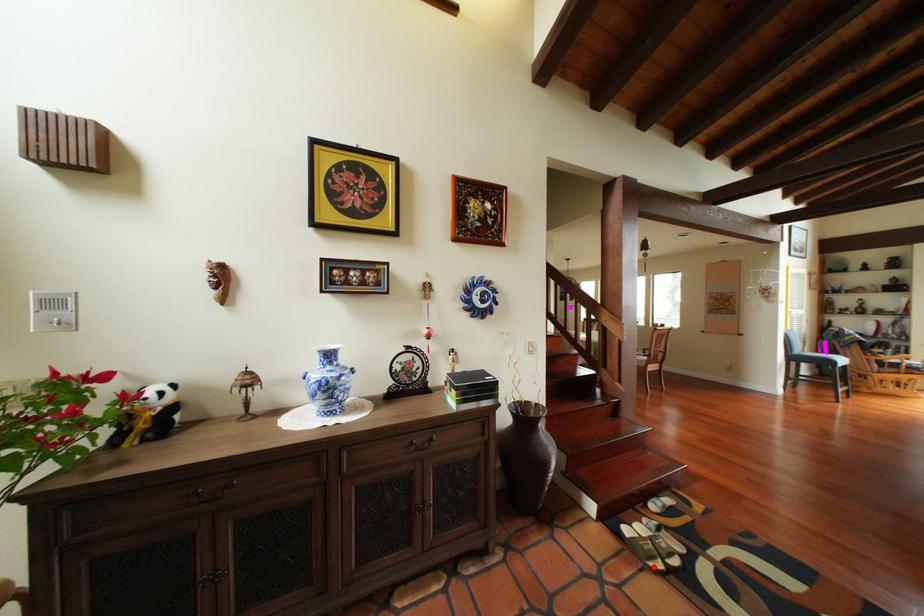
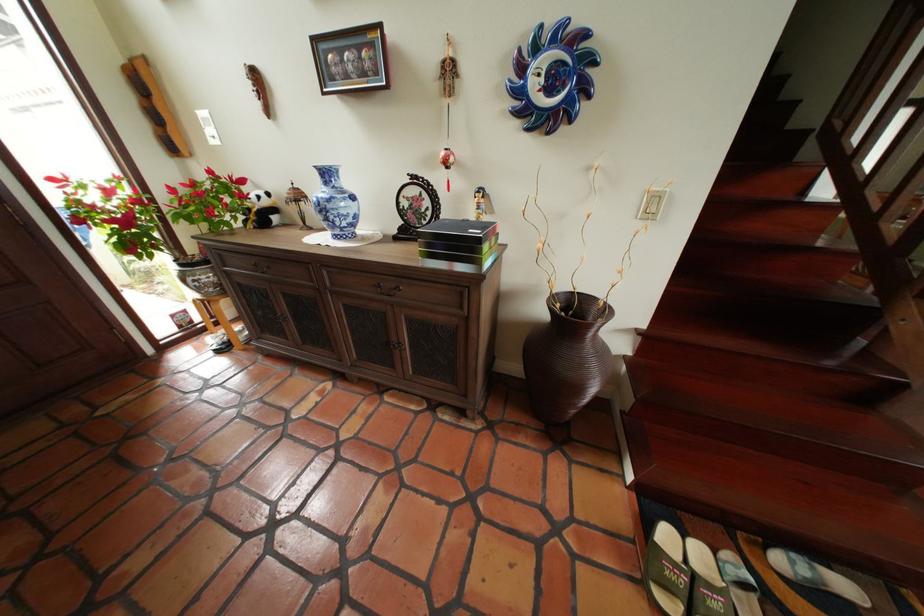
The point at the highlighted location is marked in the first image. Where is the corresponding point in the second image?

(651, 578)